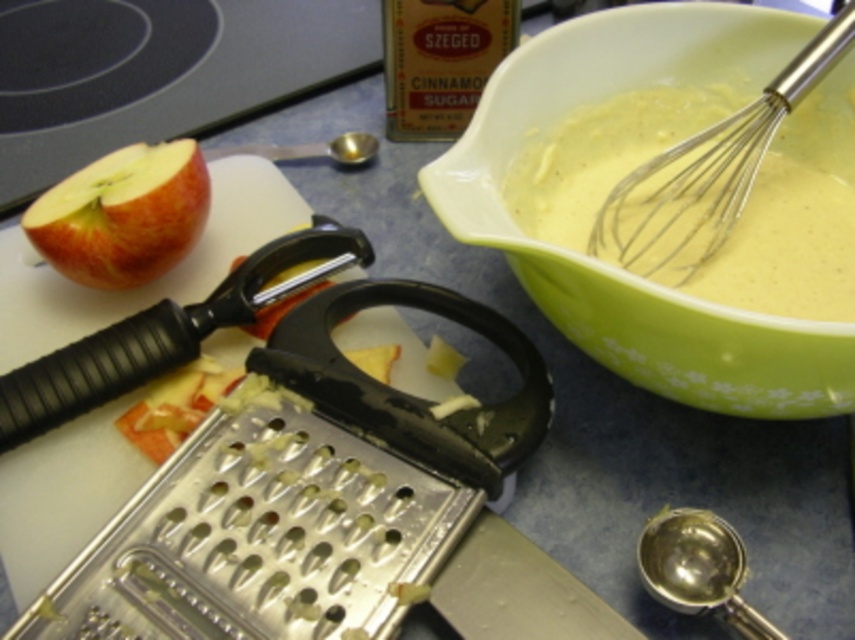
You are a baker preparing a cake and need to check if the green matte bowl at upper right can fit the metallic silver whisk at upper right inside it. Based on the scene, can the whisk fit inside the bowl?

The green matte bowl at upper right has a larger width than the metallic silver whisk at upper right, so the whisk can fit inside the bowl.

You have a small cookie cutter that is 5 cm in diameter. You want to use it to cut shapes from the red matte apple at left and the green matte bowl at upper right. Which object will allow the cookie cutter to fit more easily?

The green matte bowl at upper right has a larger width than the red matte apple at left, so the cookie cutter will fit more easily on the green matte bowl at upper right.

You are a chef preparing a recipe that requires you to pour the batter from the green matte bowl at upper right into a mold located near the red matte apple at left. Based on their positions, will the bowl be above or below the apple when you pour?

The green matte bowl at upper right is below the red matte apple at left, so when pouring, the bowl will be below the apple.